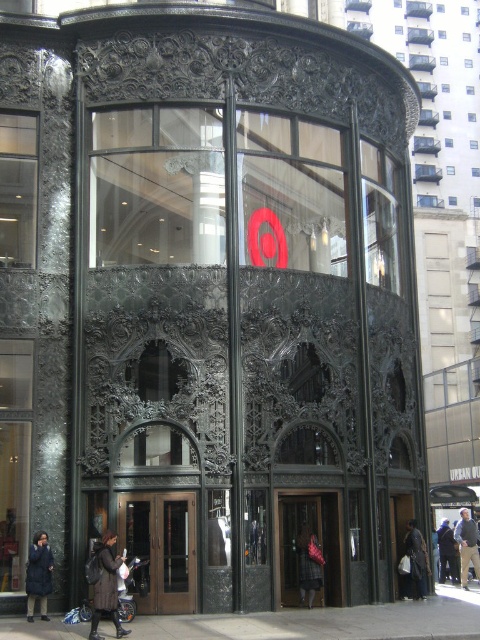
Which is above, wooden door at center or plaid wool coat at center?

Positioned higher is wooden door at center.

Is wooden door at center in front of plaid wool coat at center?

No, it is behind plaid wool coat at center.

Is point (330, 512) farther from camera compared to point (316, 563)?

Yes, point (330, 512) is behind point (316, 563).

The height and width of the screenshot is (640, 480). I want to click on wooden door at center, so click(x=307, y=548).

Is matte black glass door at center to the left of dark gray jacket at center from the viewer's perspective?

Correct, you'll find matte black glass door at center to the left of dark gray jacket at center.

At what (x,y) coordinates should I click in order to perform the action: click on matte black glass door at center. Please return your answer as a coordinate pair (x, y). The image size is (480, 640). Looking at the image, I should click on (160, 548).

Between point (175, 582) and point (460, 580), which one is positioned behind?

The point (460, 580) is more distant.

The image size is (480, 640). Find the location of `matte black glass door at center`. matte black glass door at center is located at coordinates (160, 548).

Can you confirm if matte black glass door at center is smaller than wooden door at center?

No, matte black glass door at center is not smaller than wooden door at center.

Does point (178, 524) come behind point (326, 582)?

No, it is not.

The height and width of the screenshot is (640, 480). Identify the location of matte black glass door at center. (160, 548).